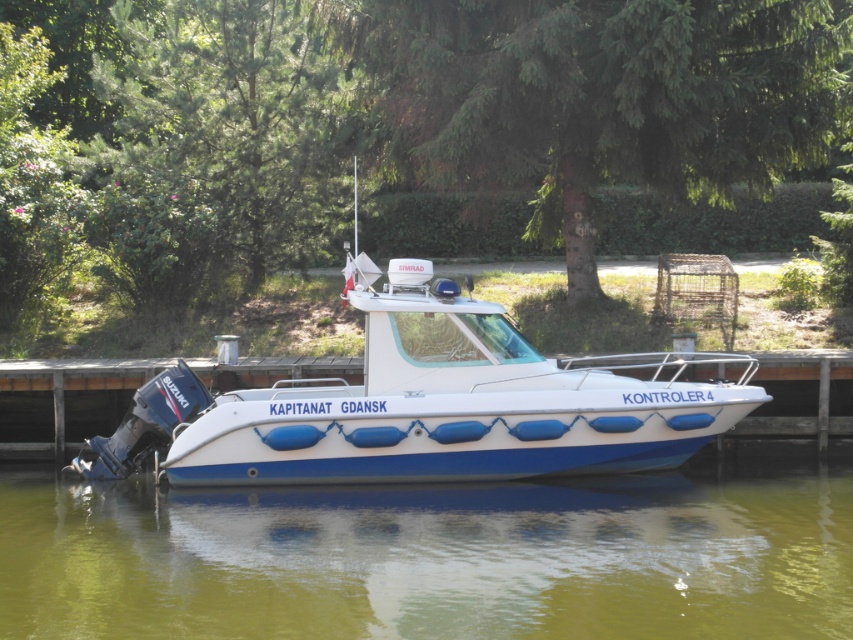
Can you confirm if white glossy boat at center is smaller than white wood dock at center?

Actually, white glossy boat at center might be larger than white wood dock at center.

Who is more forward, (x=444, y=369) or (x=322, y=364)?

Point (x=444, y=369)

At what (x,y) coordinates should I click in order to perform the action: click on white glossy boat at center. Please return your answer as a coordinate pair (x, y). Image resolution: width=853 pixels, height=640 pixels. Looking at the image, I should click on (426, 404).

Is greenish water at lower center above white glossy boat at center?

No, greenish water at lower center is not above white glossy boat at center.

Is greenish water at lower center further to the viewer compared to white glossy boat at center?

No.

The width and height of the screenshot is (853, 640). I want to click on greenish water at lower center, so click(428, 560).

Does greenish water at lower center have a larger size compared to white wood dock at center?

No.

The width and height of the screenshot is (853, 640). Describe the element at coordinates (428, 560) in the screenshot. I see `greenish water at lower center` at that location.

In order to click on greenish water at lower center in this screenshot , I will do `click(428, 560)`.